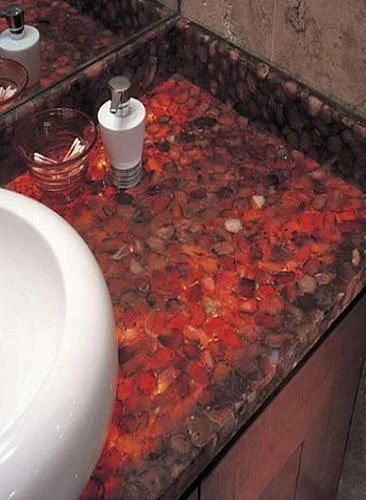
The image size is (366, 500). In order to click on sink in this screenshot , I will do `click(26, 360)`.